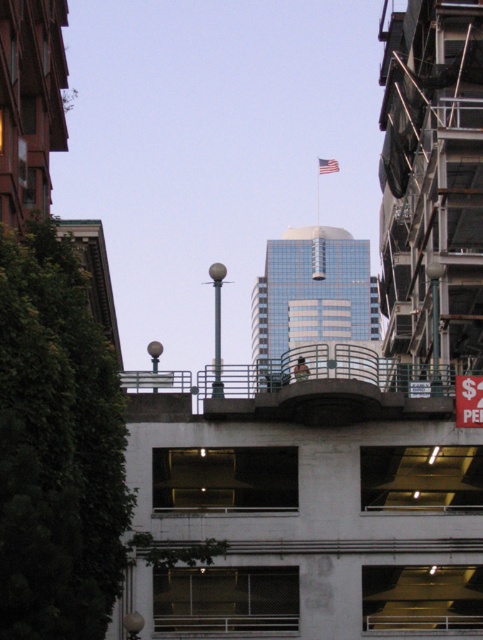
Question: Does white concrete parking garage at center appear over glassy reflective skyscraper at center?

Choices:
 (A) no
 (B) yes

Answer: (A)

Question: Can you confirm if white concrete parking garage at center is smaller than red fabric flag at upper center?

Choices:
 (A) yes
 (B) no

Answer: (B)

Question: Based on their relative distances, which object is nearer to the red fabric flag at upper center?

Choices:
 (A) glassy reflective skyscraper at center
 (B) white concrete parking garage at center

Answer: (A)

Question: Is glassy reflective skyscraper at center to the right of red fabric flag at upper center from the viewer's perspective?

Choices:
 (A) no
 (B) yes

Answer: (A)

Question: Which object is positioned closest to the red fabric flag at upper center?

Choices:
 (A) glassy reflective skyscraper at center
 (B) white concrete parking garage at center

Answer: (A)

Question: Which object is closer to the camera taking this photo?

Choices:
 (A) glassy reflective skyscraper at center
 (B) red fabric flag at upper center

Answer: (A)